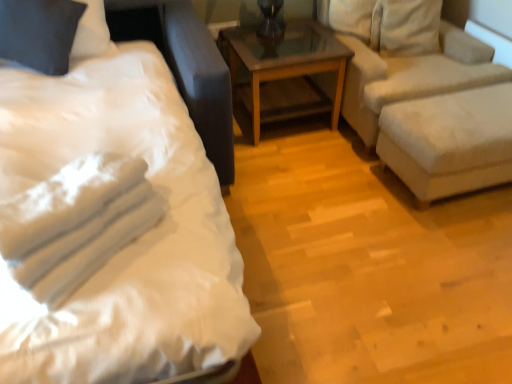
Question: From the image's perspective, is white cotton towels at left positioned above or below white fabric ottoman at right?

Choices:
 (A) below
 (B) above

Answer: (A)

Question: Which is correct: white cotton towels at left is inside white fabric ottoman at right, or outside of it?

Choices:
 (A) outside
 (B) inside

Answer: (A)

Question: Based on their relative distances, which object is nearer to the dark gray fabric pillow at upper left?

Choices:
 (A) brown wooden table at center
 (B) white fabric ottoman at right
 (C) beige fabric studio couch at right
 (D) white satin bed at left
 (E) white cotton towels at left

Answer: (D)

Question: Estimate the real-world distances between objects in this image. Which object is closer to the white satin bed at left?

Choices:
 (A) white cotton towels at left
 (B) white fabric ottoman at right
 (C) brown wooden table at center
 (D) dark gray fabric pillow at upper left
 (E) beige fabric studio couch at right

Answer: (A)